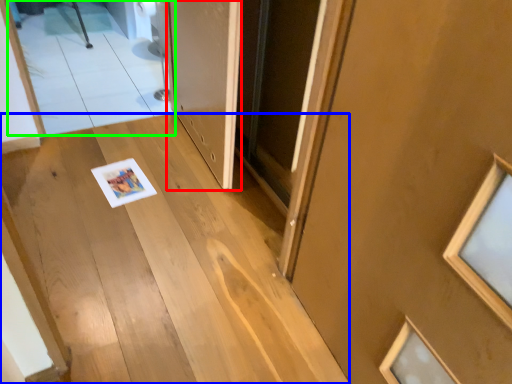
Question: Which object is positioned closest to door (highlighted by a red box)? Select from stairs (highlighted by a blue box) and mirror (highlighted by a green box).

Choices:
 (A) stairs
 (B) mirror

Answer: (A)